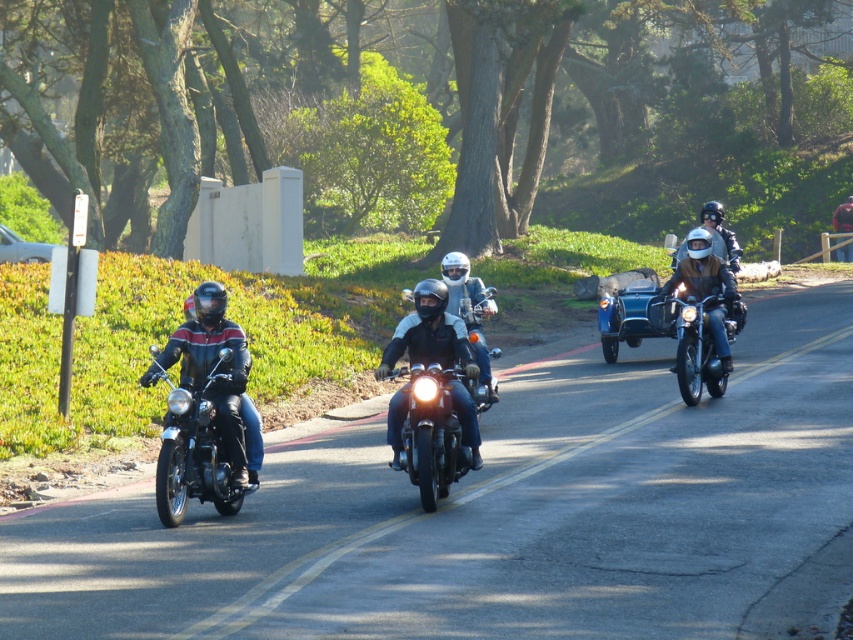
You are a photographer positioned at the starting point of the road. You want to capture two points of interest in the scene. The first point is point 1 at coordinates point [399,465], and the second is point 2 at coordinates point [691,305]. Which point should you focus on first to ensure they appear in the correct order from front to back in your photo?

You should focus on point 1 at coordinates point [399,465] first because it is in front of point 2 at coordinates point [691,305], ensuring the correct front to back order in the photo.

What is the color of the motorcycle located at point (193, 445)?

The motorcycle at point (193, 445) is shiny black.